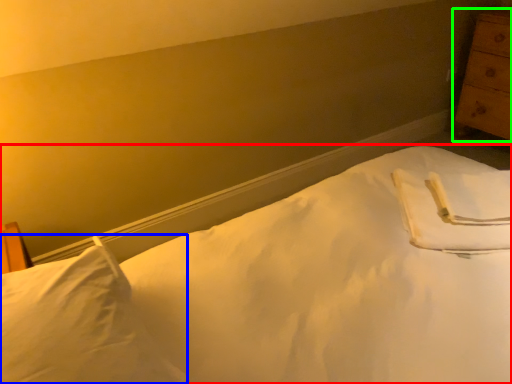
Question: Based on their relative distances, which object is nearer to bed (highlighted by a red box)? Choose from pillow (highlighted by a blue box) and chest of drawers (highlighted by a green box).

Choices:
 (A) pillow
 (B) chest of drawers

Answer: (A)